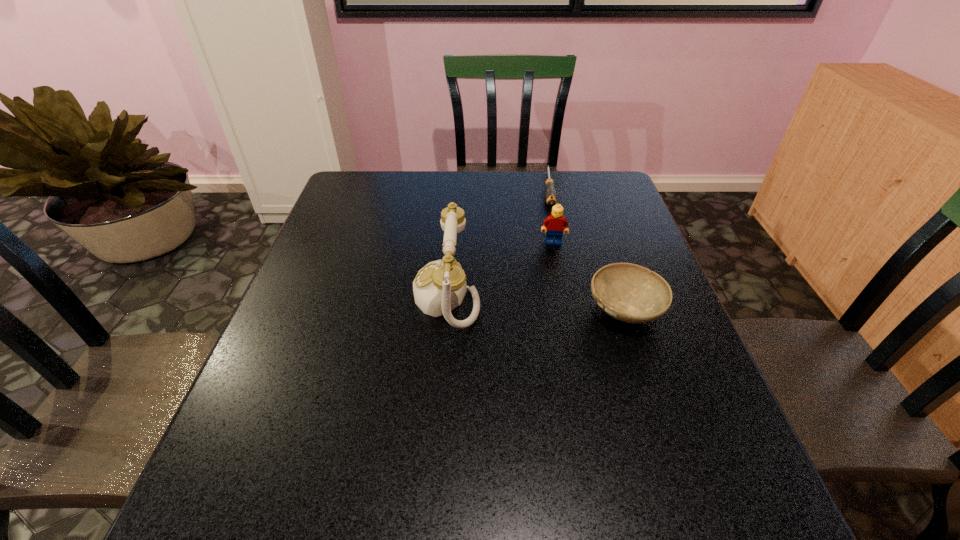
At what (x,y) coordinates should I click in order to perform the action: click on telephone. Please return your answer as a coordinate pair (x, y). The image size is (960, 540). Looking at the image, I should click on (439, 287).

Image resolution: width=960 pixels, height=540 pixels. In order to click on the tallest object in this screenshot , I will do `click(439, 287)`.

The width and height of the screenshot is (960, 540). I want to click on the rightmost object, so click(x=628, y=292).

Find the location of a particular element. Image resolution: width=960 pixels, height=540 pixels. the second shortest object is located at coordinates (628, 292).

Where is `the farthest object`? the farthest object is located at coordinates (550, 195).

Find the location of a particular element. the shortest object is located at coordinates click(550, 195).

This screenshot has height=540, width=960. Identify the location of the second tallest object. (555, 223).

The height and width of the screenshot is (540, 960). I want to click on Lego, so click(x=555, y=223).

The image size is (960, 540). In order to click on vacant space located on the dial of the tallest object in this screenshot , I will do `click(392, 295)`.

Identify the location of vacant area situated on the dial of the tallest object. Image resolution: width=960 pixels, height=540 pixels. (363, 295).